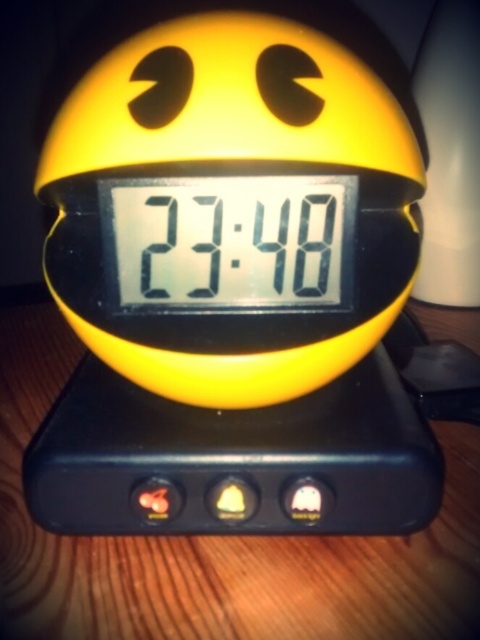
Which is in front, point (377, 529) or point (192, 589)?

Positioned in front is point (192, 589).

Is point (228, 394) behind point (91, 598)?

Yes, it is.

Find the location of `black plastic scale at center`. black plastic scale at center is located at coordinates [x=232, y=266].